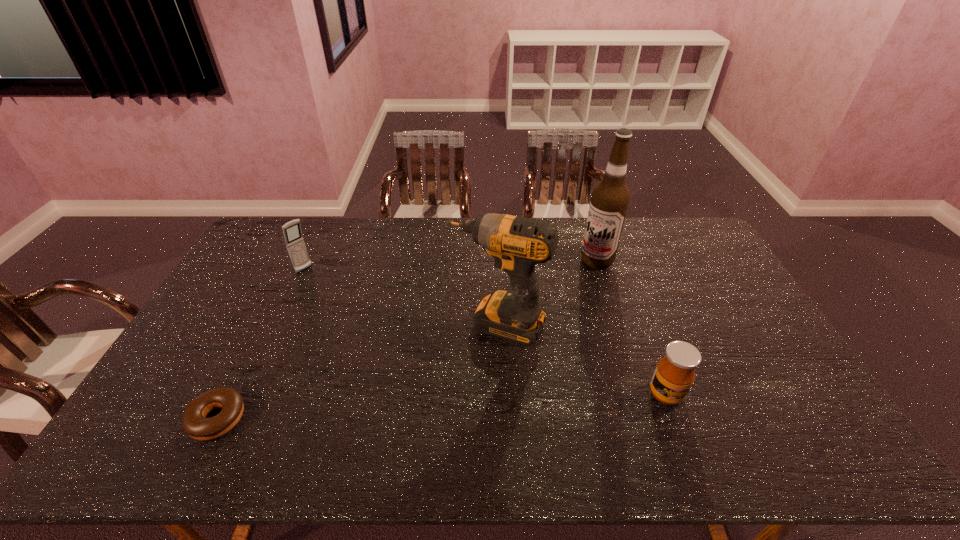
Where is `object situated at the near left corner`? Image resolution: width=960 pixels, height=540 pixels. object situated at the near left corner is located at coordinates (194, 423).

Image resolution: width=960 pixels, height=540 pixels. In the image, there is a desktop. Find the location of `blank space at the far edge`. blank space at the far edge is located at coordinates (330, 246).

Where is `free point at the near edge`? Image resolution: width=960 pixels, height=540 pixels. free point at the near edge is located at coordinates (308, 394).

Image resolution: width=960 pixels, height=540 pixels. In the image, there is a desktop. What are the coordinates of `vacant space at the left edge` in the screenshot? It's located at (254, 276).

This screenshot has width=960, height=540. In order to click on vacant region at the right edge of the desktop in this screenshot , I will do `click(715, 292)`.

The image size is (960, 540). I want to click on free space between the doughnut and the drill, so click(357, 372).

Where is `unoccupied area between the shortest object and the fourth tallest object`? The width and height of the screenshot is (960, 540). unoccupied area between the shortest object and the fourth tallest object is located at coordinates (442, 406).

Locate an element on the screen. The height and width of the screenshot is (540, 960). free space that is in between the shortest object and the fourth shortest object is located at coordinates (357, 372).

The height and width of the screenshot is (540, 960). Find the location of `vacant space that is in between the alcohol and the doughnut`. vacant space that is in between the alcohol and the doughnut is located at coordinates (407, 340).

Where is `vacant area that lies between the doughnut and the tallest object`? The width and height of the screenshot is (960, 540). vacant area that lies between the doughnut and the tallest object is located at coordinates (407, 340).